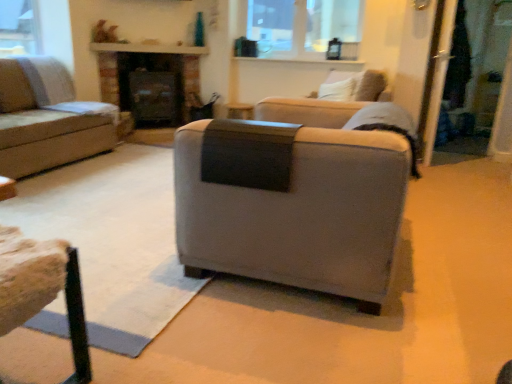
Question: Looking at the image, does clear glass window at upper center seem bigger or smaller compared to suede gray armchair at center, acting as the second studio couch starting from the left?

Choices:
 (A) big
 (B) small

Answer: (B)

Question: Considering the positions of point (324, 36) and point (180, 142), is point (324, 36) closer or farther from the camera than point (180, 142)?

Choices:
 (A) farther
 (B) closer

Answer: (A)

Question: Estimate the real-world distances between objects in this image. Which object is closer to the clear glass screen door at right, positioned as the first screen door in left-to-right order?

Choices:
 (A) wooden textured stool at lower left
 (B) light beige fabric couch at left, acting as the first studio couch starting from the back
 (C) light gray fabric armchair at upper right
 (D) clear glass window at upper center
 (E) suede gray armchair at center, arranged as the 1th studio couch when viewed from the right

Answer: (C)

Question: Which of these objects is positioned closest to the wooden textured stool at lower left?

Choices:
 (A) clear glass window at upper center
 (B) light gray fabric armchair at upper right
 (C) matte black fireplace at center
 (D) light beige fabric couch at left, the 2th studio couch viewed from the right
 (E) clear glass screen door at right, positioned as the first screen door in left-to-right order

Answer: (B)